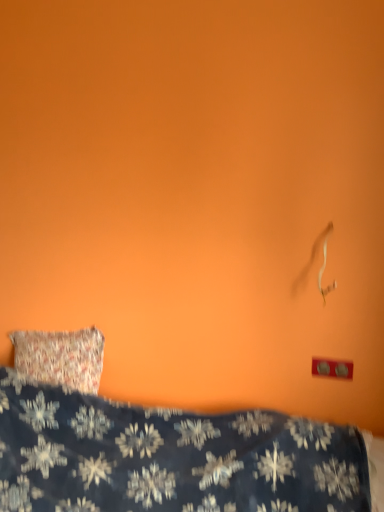
Question: Considering the relative positions of red plastic outlet at lower right and dark blue fabric with snowflake pattern at lower left in the image provided, is red plastic outlet at lower right to the left or to the right of dark blue fabric with snowflake pattern at lower left?

Choices:
 (A) left
 (B) right

Answer: (B)

Question: From a real-world perspective, is red plastic outlet at lower right above or below dark blue fabric with snowflake pattern at lower left?

Choices:
 (A) below
 (B) above

Answer: (B)

Question: Does point (342, 361) appear closer or farther from the camera than point (345, 440)?

Choices:
 (A) farther
 (B) closer

Answer: (A)

Question: From a real-world perspective, is dark blue fabric with snowflake pattern at lower left above or below red plastic outlet at lower right?

Choices:
 (A) above
 (B) below

Answer: (B)

Question: Based on their positions, is dark blue fabric with snowflake pattern at lower left located to the left or right of red plastic outlet at lower right?

Choices:
 (A) left
 (B) right

Answer: (A)

Question: Is point (263, 462) closer or farther from the camera than point (349, 368)?

Choices:
 (A) closer
 (B) farther

Answer: (A)

Question: Relative to red plastic outlet at lower right, is dark blue fabric with snowflake pattern at lower left in front or behind?

Choices:
 (A) behind
 (B) front

Answer: (B)